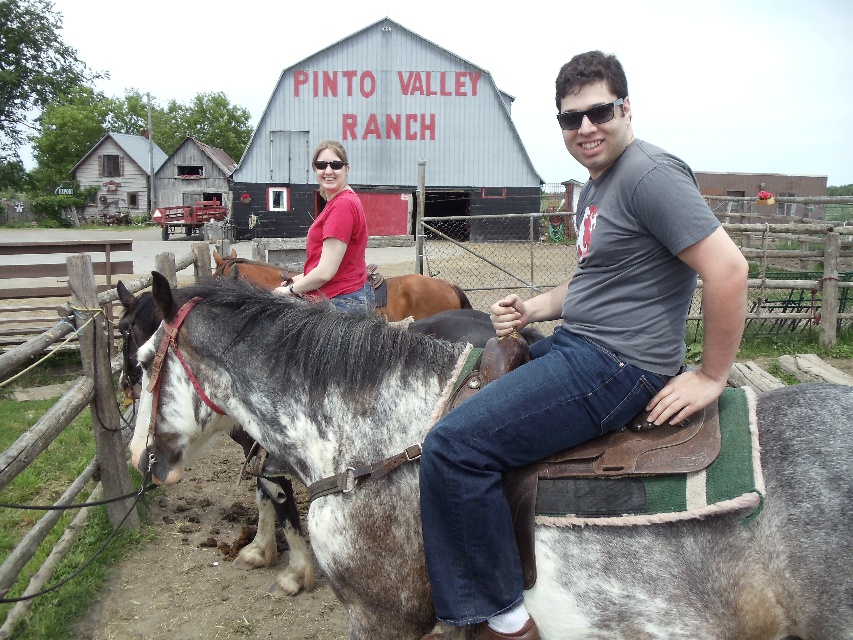
Does matte red shirt at center have a lesser width compared to sunglasses at upper center?

No.

Does point (322, 241) come farther from viewer compared to point (573, 124)?

Yes, it is.

The image size is (853, 640). I want to click on matte red shirt at center, so click(334, 237).

Which is above, matte gray shirt at center or brown leather saddle at center?

brown leather saddle at center

Who is positioned more to the left, matte gray shirt at center or brown leather saddle at center?

brown leather saddle at center

Image resolution: width=853 pixels, height=640 pixels. Find the location of `matte gray shirt at center`. matte gray shirt at center is located at coordinates (581, 349).

Looking at this image, can you confirm if speckled leather saddle at center is smaller than sunglasses at upper center?

Correct, speckled leather saddle at center occupies less space than sunglasses at upper center.

Locate an element on the screen. The image size is (853, 640). speckled leather saddle at center is located at coordinates (723, 547).

Image resolution: width=853 pixels, height=640 pixels. I want to click on speckled leather saddle at center, so click(x=723, y=547).